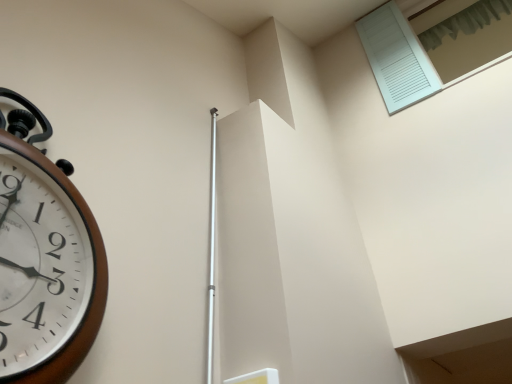
Question: Is white matte shutter at upper right, the 1th window in the bottom-to-top sequence, smaller than brown wooden wall clock at left?

Choices:
 (A) no
 (B) yes

Answer: (A)

Question: Is brown wooden wall clock at left at the back of white matte shutter at upper right, the 2th window in the top-to-bottom sequence?

Choices:
 (A) no
 (B) yes

Answer: (A)

Question: Is white matte shutter at upper right, the 1th window in the bottom-to-top sequence, aimed at brown wooden wall clock at left?

Choices:
 (A) no
 (B) yes

Answer: (A)

Question: Is white matte shutter at upper right, the 2th window in the top-to-bottom sequence, wider than brown wooden wall clock at left?

Choices:
 (A) yes
 (B) no

Answer: (A)

Question: From a real-world perspective, is white matte shutter at upper right, the 2th window in the top-to-bottom sequence, positioned under brown wooden wall clock at left based on gravity?

Choices:
 (A) yes
 (B) no

Answer: (B)

Question: Is point (430, 56) positioned closer to the camera than point (96, 238)?

Choices:
 (A) closer
 (B) farther

Answer: (B)

Question: From a real-world perspective, relative to brown wooden wall clock at left, is white matte shutter at upper right, the 1th window in the bottom-to-top sequence, vertically above or below?

Choices:
 (A) above
 (B) below

Answer: (A)

Question: Is white matte shutter at upper right, the 2th window in the top-to-bottom sequence, in front of or behind brown wooden wall clock at left in the image?

Choices:
 (A) behind
 (B) front

Answer: (A)

Question: In terms of width, does white matte shutter at upper right, the 1th window in the bottom-to-top sequence, look wider or thinner when compared to brown wooden wall clock at left?

Choices:
 (A) thin
 (B) wide

Answer: (B)

Question: From a real-world perspective, relative to white matte shutter at upper right, the 1th window in the bottom-to-top sequence, is white textured shutter at upper right, which ranks as the second window in bottom-to-top order, vertically above or below?

Choices:
 (A) below
 (B) above

Answer: (B)

Question: Is white textured shutter at upper right, which ranks as the second window in bottom-to-top order, inside the boundaries of white matte shutter at upper right, the 1th window in the bottom-to-top sequence, or outside?

Choices:
 (A) outside
 (B) inside

Answer: (A)

Question: Does point (453, 48) appear closer or farther from the camera than point (422, 91)?

Choices:
 (A) closer
 (B) farther

Answer: (B)

Question: Considering the positions of white textured shutter at upper right, which ranks as the second window in bottom-to-top order, and white matte shutter at upper right, the 2th window in the top-to-bottom sequence, in the image, is white textured shutter at upper right, which ranks as the second window in bottom-to-top order, taller or shorter than white matte shutter at upper right, the 2th window in the top-to-bottom sequence,?

Choices:
 (A) short
 (B) tall

Answer: (A)

Question: From a real-world perspective, relative to white textured shutter at upper right, the 1th window viewed from the top, is brown wooden wall clock at left vertically above or below?

Choices:
 (A) above
 (B) below

Answer: (B)

Question: Is brown wooden wall clock at left taller or shorter than white textured shutter at upper right, which ranks as the second window in bottom-to-top order?

Choices:
 (A) short
 (B) tall

Answer: (B)